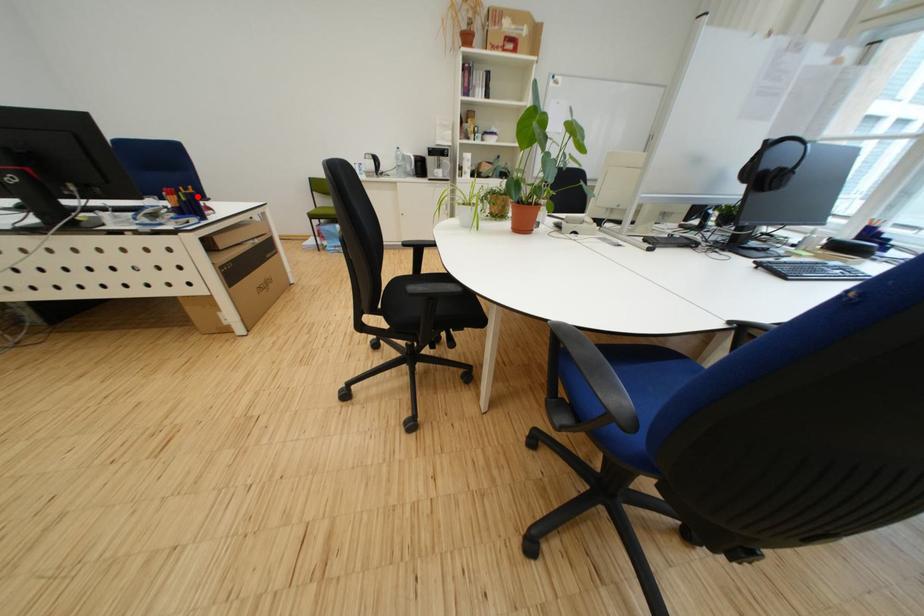
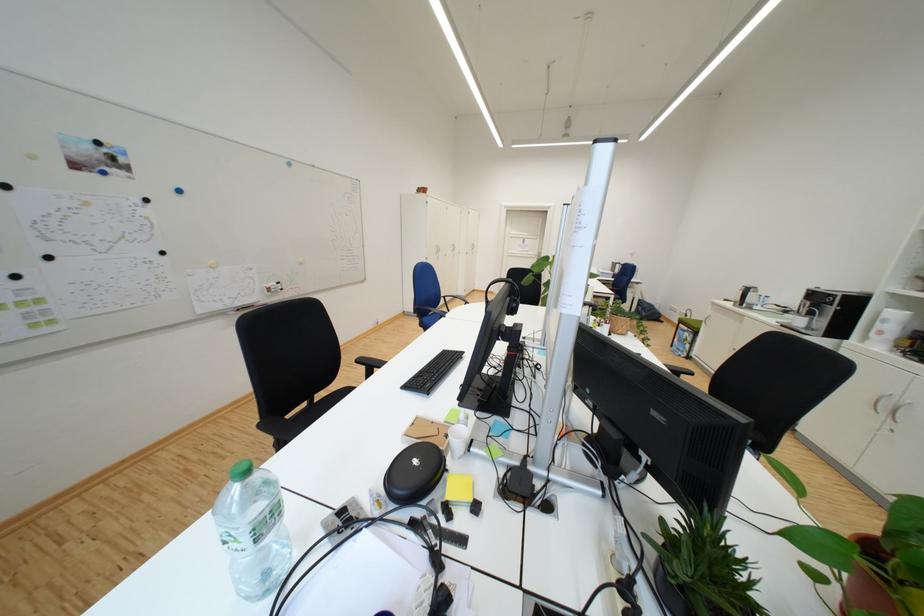
Question: I am providing you with two images of the same scene from different viewpoints. A red point is marked on the first image. Is the red point's position out of view in image 2?

Choices:
 (A) Yes
 (B) No

Answer: (A)